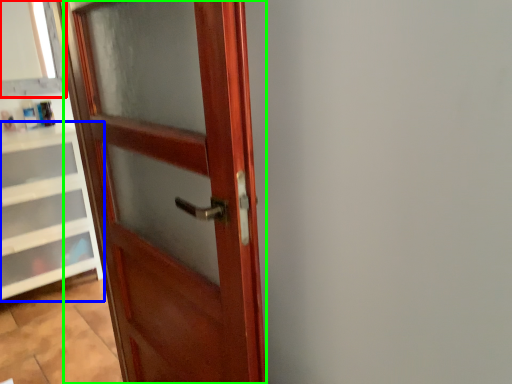
Question: Estimate the real-world distances between objects in this image. Which object is farther from window frame (highlighted by a red box), cabinetry (highlighted by a blue box) or door (highlighted by a green box)?

Choices:
 (A) cabinetry
 (B) door

Answer: (B)